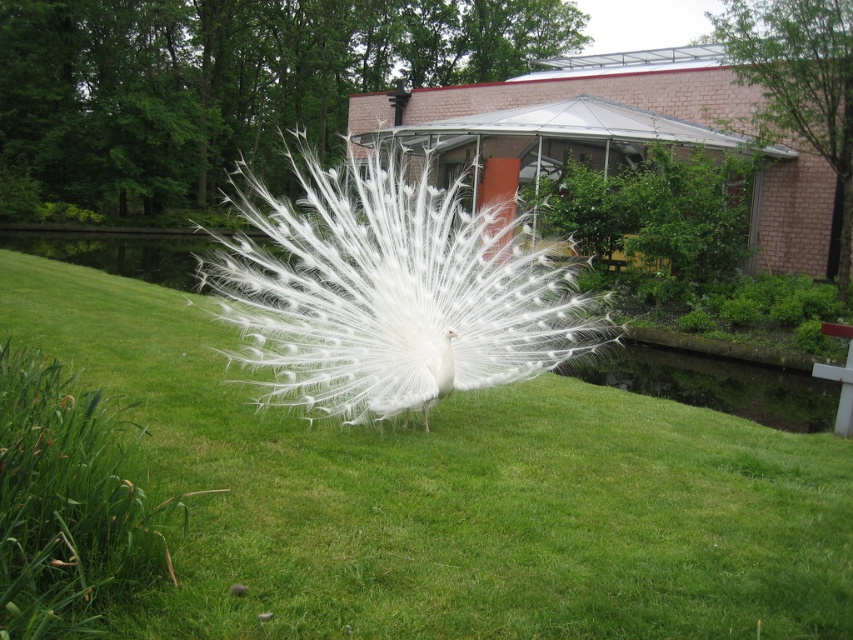
Can you confirm if green grassy at center is shorter than white feathered peacock at center?

Indeed, green grassy at center has a lesser height compared to white feathered peacock at center.

Is green grassy at center to the right of white feathered peacock at center from the viewer's perspective?

Correct, you'll find green grassy at center to the right of white feathered peacock at center.

You are a GUI agent. You are given a task and a screenshot of the screen. Output one action in this format:
    pyautogui.click(x=<x>, y=<y>)
    Task: Click on the green grassy at center
    This screenshot has width=853, height=640.
    Given the screenshot: What is the action you would take?
    pyautogui.click(x=450, y=497)

I want to click on green grassy at center, so click(450, 497).